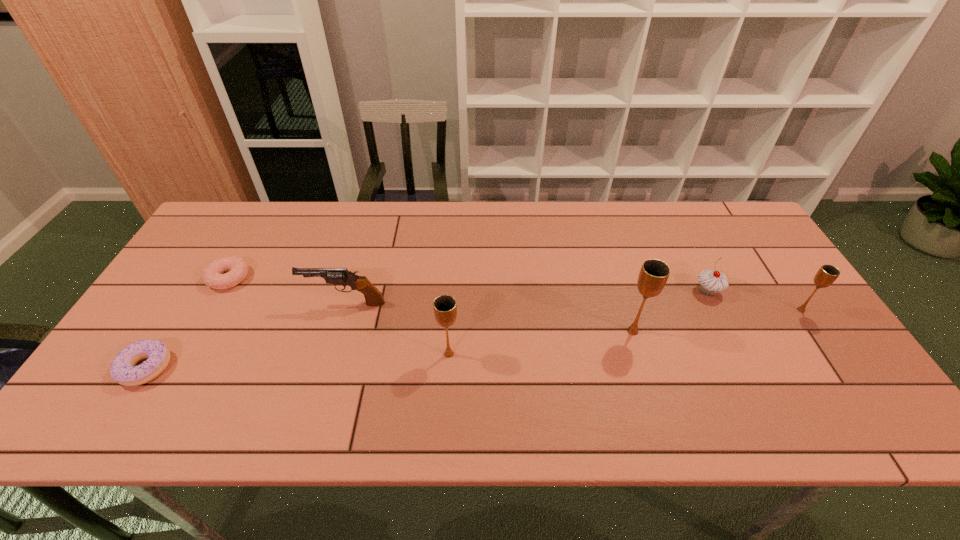
This screenshot has width=960, height=540. What are the coordinates of `vacant space that is in between the farther doughnut and the nearer doughnut` in the screenshot? It's located at (187, 323).

At what (x,y) coordinates should I click in order to perform the action: click on free point between the third object from left to right and the fifth farthest object. Please return your answer as a coordinate pair (x, y). The height and width of the screenshot is (540, 960). Looking at the image, I should click on (489, 317).

Identify the location of vacant space in between the farthest chalice and the third object from left to right. pyautogui.click(x=573, y=307).

Image resolution: width=960 pixels, height=540 pixels. Find the location of `empty space that is in between the third object from left to right and the tallest chalice`. empty space that is in between the third object from left to right and the tallest chalice is located at coordinates (489, 317).

Where is `free space between the gun and the rightmost object`? Image resolution: width=960 pixels, height=540 pixels. free space between the gun and the rightmost object is located at coordinates (573, 307).

At what (x,y) coordinates should I click in order to perform the action: click on free spot between the nearest chalice and the farther doughnut. Please return your answer as a coordinate pair (x, y). The height and width of the screenshot is (540, 960). Looking at the image, I should click on (339, 316).

Where is `vacant area that lies between the tallest object and the sixth object from left to right`? This screenshot has height=540, width=960. vacant area that lies between the tallest object and the sixth object from left to right is located at coordinates (670, 311).

This screenshot has width=960, height=540. In order to click on blank region between the nearer doughnut and the fourth object from left to right in this screenshot , I will do `click(298, 361)`.

The width and height of the screenshot is (960, 540). I want to click on empty space between the shortest chalice and the second farthest chalice, so click(x=717, y=320).

This screenshot has height=540, width=960. In order to click on object that is the closest to the sixth shortest object in this screenshot , I will do `click(338, 276)`.